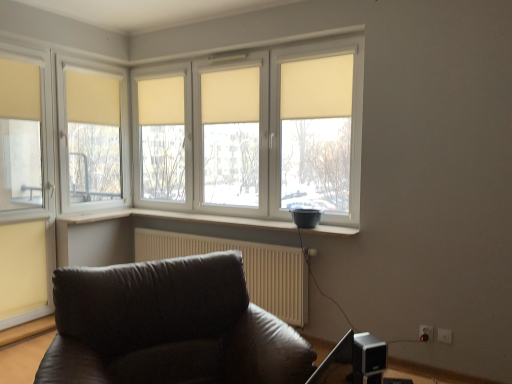
Locate an element on the screen. This screenshot has height=384, width=512. free spot above beige fabric curtain at center, which is the third curtain in left-to-right order (from a real-world perspective) is located at coordinates (162, 72).